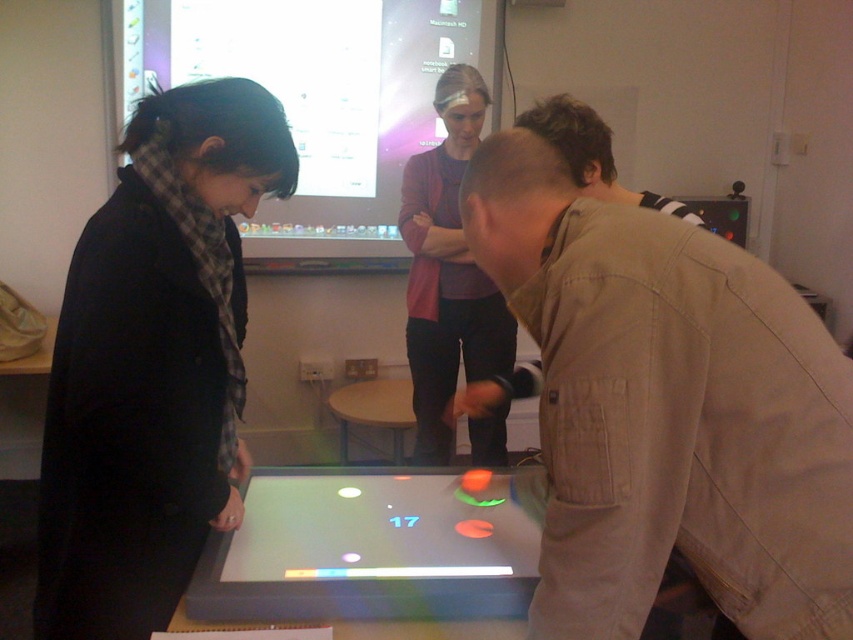
You are a visitor observing the scene and want to take a photo of the matte black screen at upper center and the gray plastic table at center. Which object is wider?

The matte black screen at upper center is wider than the gray plastic table at center.

You are standing in front of the interactive table and notice two objects at the center. Which one is taller, the khaki cotton shirt at center or the gray plastic table at center?

The khaki cotton shirt at center is taller than the gray plastic table at center.